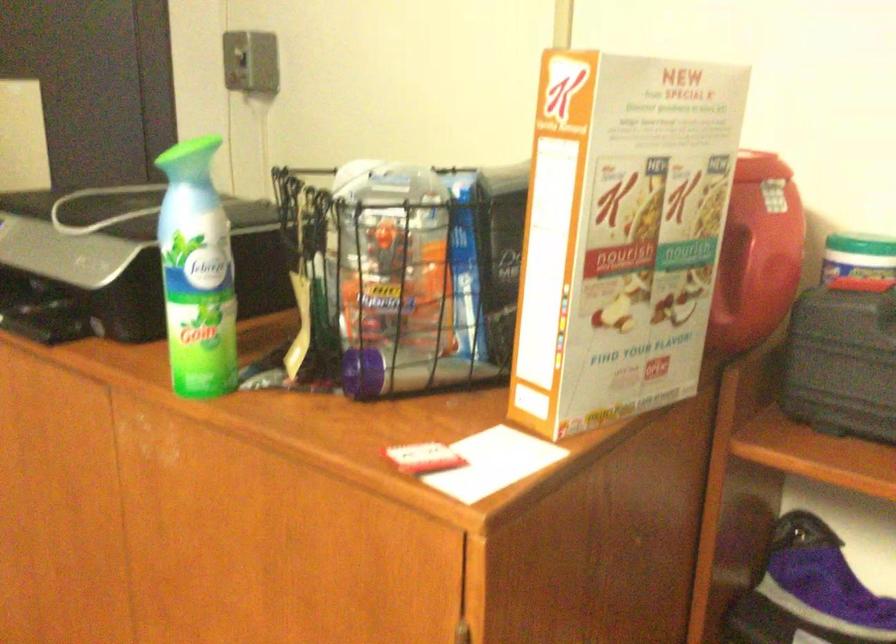
At what (x,y) coordinates should I click in order to perform the action: click on scanner lid. Please return your answer as a coordinate pair (x, y). Looking at the image, I should click on (71, 261).